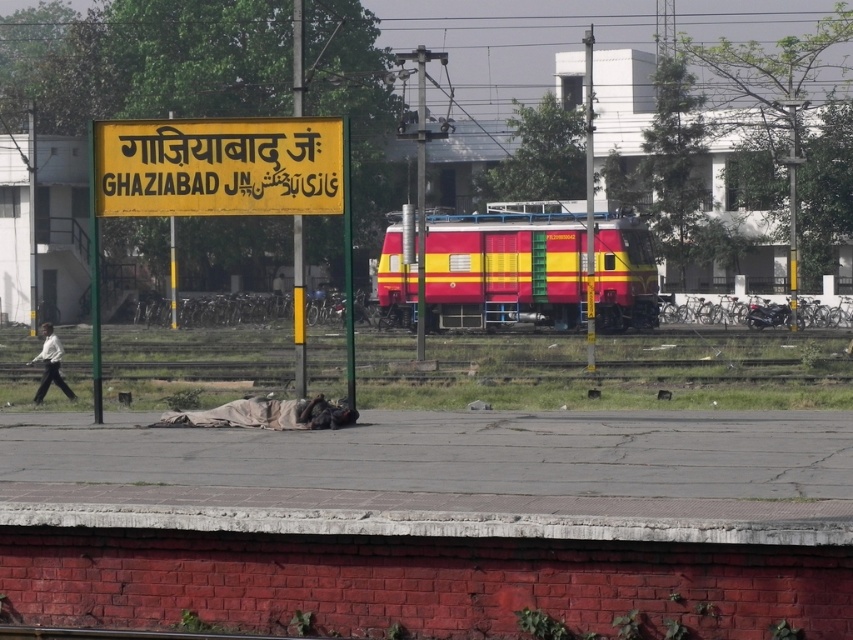
From the picture: Which is more to the right, yellow matte signboard at upper center or metallic pole at center?

From the viewer's perspective, metallic pole at center appears more on the right side.

Is yellow matte signboard at upper center to the right of metallic pole at center from the viewer's perspective?

No, yellow matte signboard at upper center is not to the right of metallic pole at center.

Which is behind, point (206, 129) or point (590, 355)?

The point (590, 355) is behind.

Where is `yellow matte signboard at upper center`? The image size is (853, 640). yellow matte signboard at upper center is located at coordinates (218, 166).

Measure the distance from yellow painted metal pole at center to dark fabric sleeping bag at center.

yellow painted metal pole at center is 17.02 meters from dark fabric sleeping bag at center.

Locate an element on the screen. This screenshot has height=640, width=853. yellow painted metal pole at center is located at coordinates (299, 308).

The width and height of the screenshot is (853, 640). I want to click on yellow painted metal pole at center, so click(x=299, y=308).

Looking at this image, does yellow matte signboard at upper center appear over brown fabric at center?

Yes.

Is point (310, 168) more distant than point (270, 416)?

Yes.

Locate an element on the screen. yellow matte signboard at upper center is located at coordinates (218, 166).